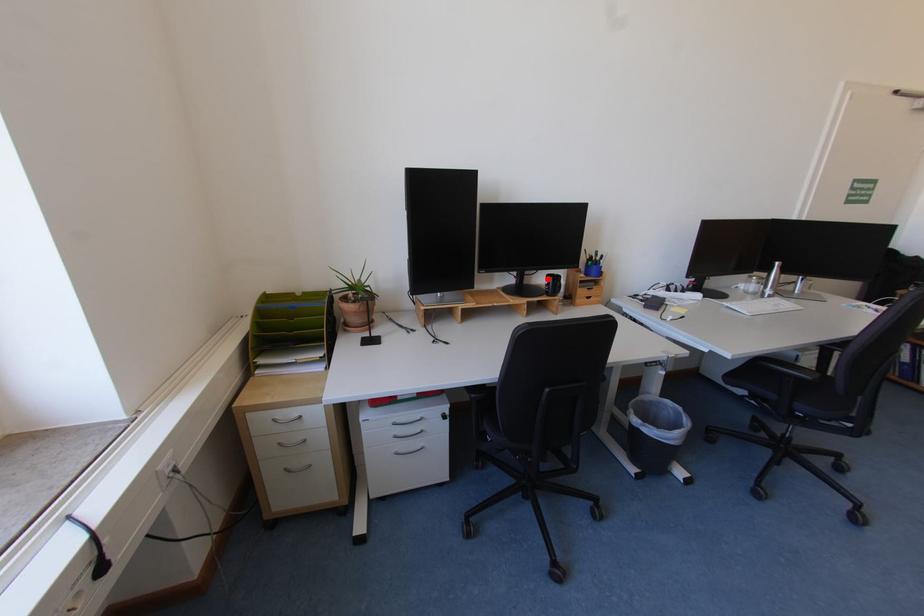
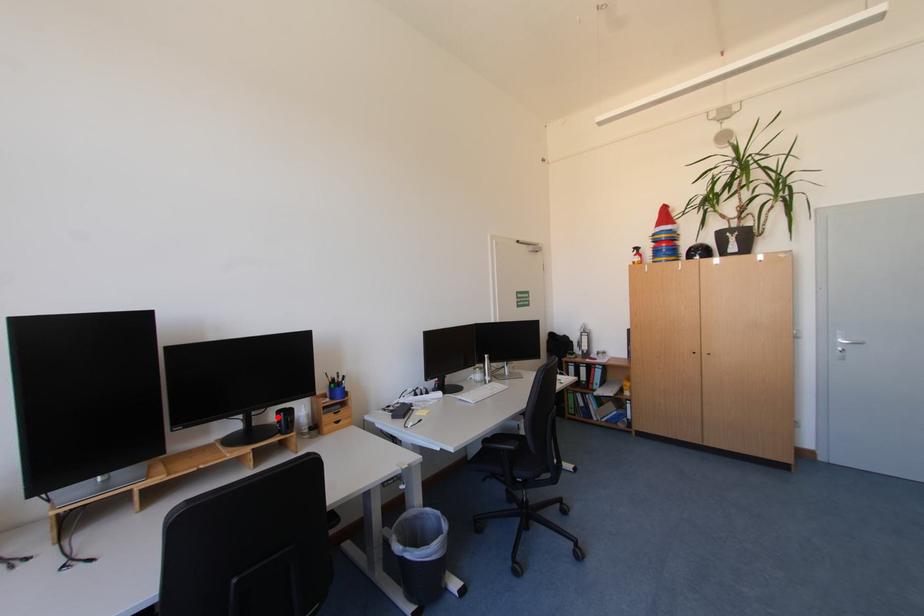
I am providing you with two images of the same scene from different viewpoints. A red point is marked on the first image and another point is marked on the second image. Do the highlighted points in image1 and image2 indicate the same real-world spot?

Yes